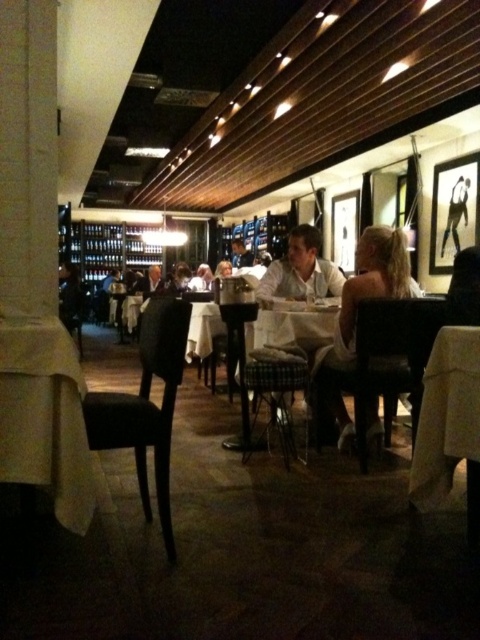
Which is more to the left, white cloth table at lower right or silhouette paper at upper right?

Positioned to the left is white cloth table at lower right.

Can you confirm if white cloth table at lower right is positioned below silhouette paper at upper right?

Indeed, white cloth table at lower right is positioned under silhouette paper at upper right.

Describe the element at coordinates (448, 424) in the screenshot. The width and height of the screenshot is (480, 640). I see `white cloth table at lower right` at that location.

Locate an element on the screen. Image resolution: width=480 pixels, height=640 pixels. white cloth table at lower right is located at coordinates (448, 424).

Who is lower down, white linen table at lower left or light brown leather chair at center?

Positioned lower is white linen table at lower left.

Which is in front, point (62, 499) or point (397, 246)?

Positioned in front is point (62, 499).

The image size is (480, 640). I want to click on white linen table at lower left, so click(x=46, y=417).

Is white linen table at lower left thinner than white shirt at center?

Correct, white linen table at lower left's width is less than white shirt at center's.

Locate an element on the screen. Image resolution: width=480 pixels, height=640 pixels. white linen table at lower left is located at coordinates (46, 417).

Describe the element at coordinates (46, 417) in the screenshot. I see `white linen table at lower left` at that location.

Image resolution: width=480 pixels, height=640 pixels. What are the coordinates of `white linen table at lower left` in the screenshot? It's located at (46, 417).